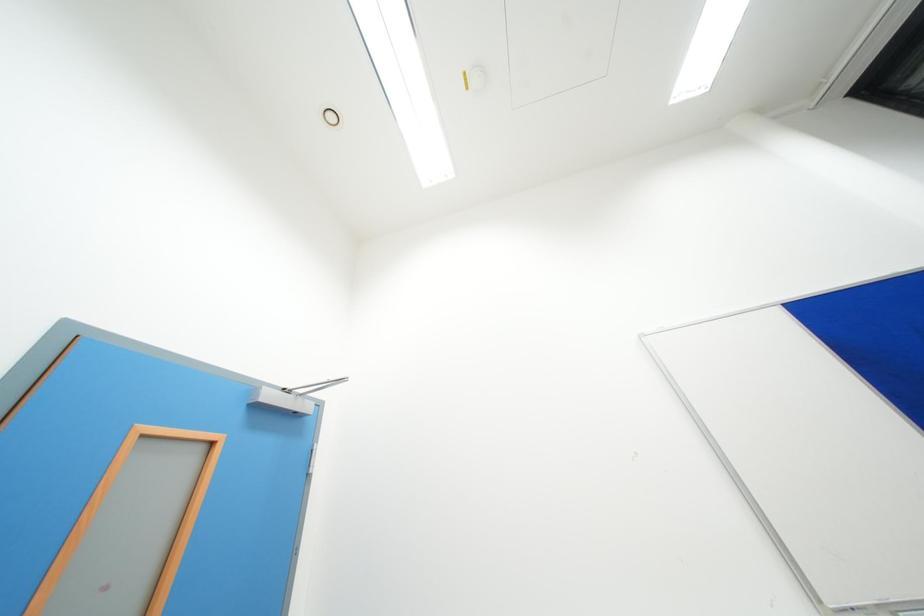
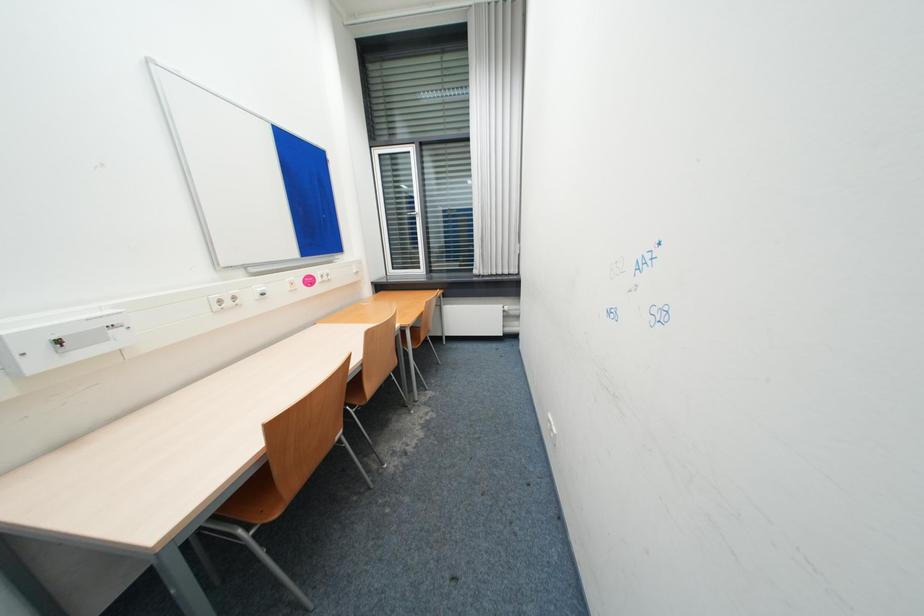
Question: How did the camera likely rotate?

Choices:
 (A) Left
 (B) Right
 (C) Up
 (D) Down

Answer: (B)